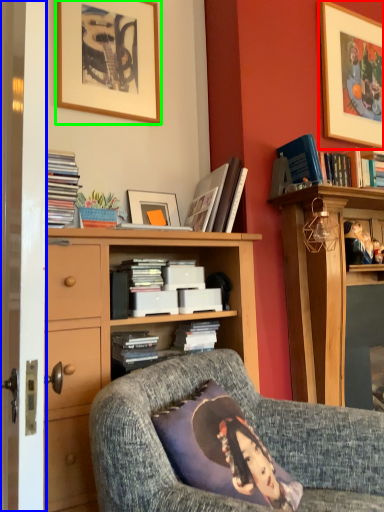
Question: Estimate the real-world distances between objects in this image. Which object is closer to picture frame (highlighted by a red box), screen door (highlighted by a blue box) or picture frame (highlighted by a green box)?

Choices:
 (A) screen door
 (B) picture frame

Answer: (B)